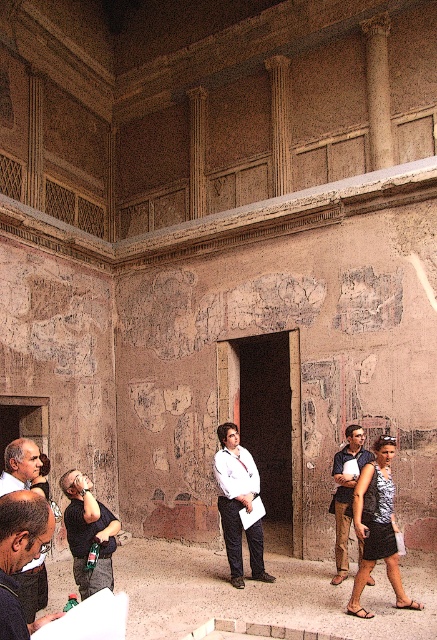
Based on the photo, you are standing in the historical building and want to determine the relative positions of two points marked on the ceiling. The first point is at coordinates point (x=395, y=576) and the second is at point (x=336, y=573). Which point is closer to you?

Point (x=395, y=576) is closer to the viewer than point (x=336, y=573).